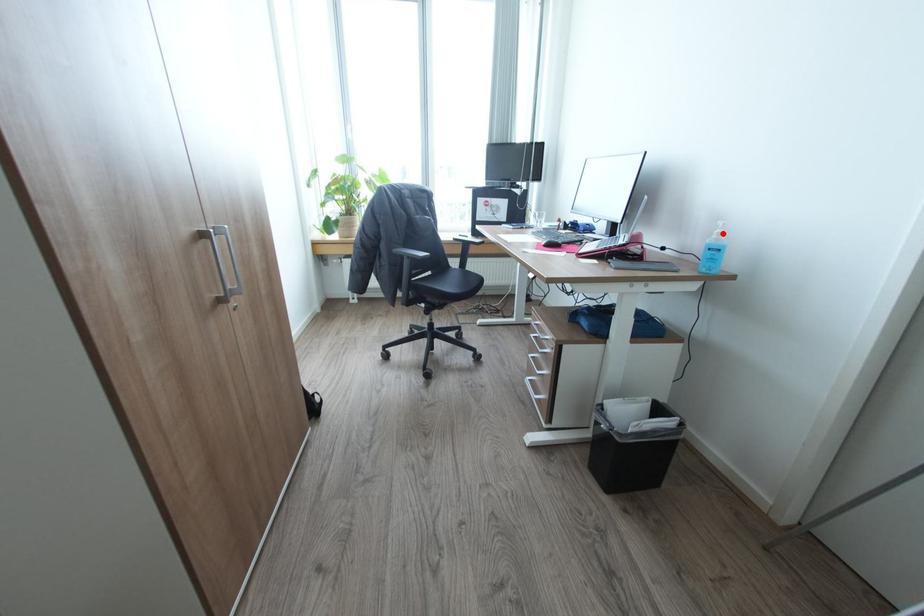
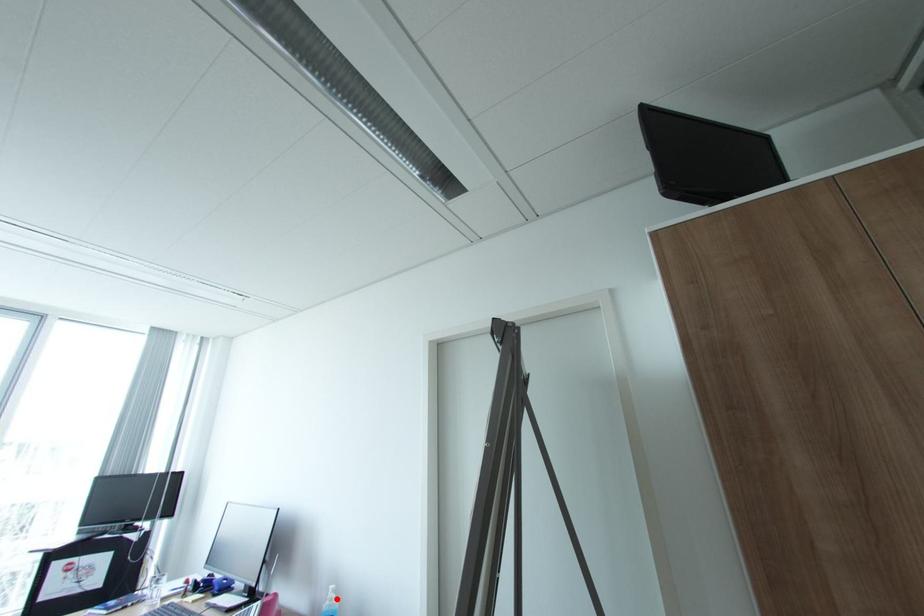
I am providing you with two images of the same scene from different viewpoints. A red point is marked on the first image and another point is marked on the second image. Is the red point in image1 aligned with the point shown in image2?

Yes